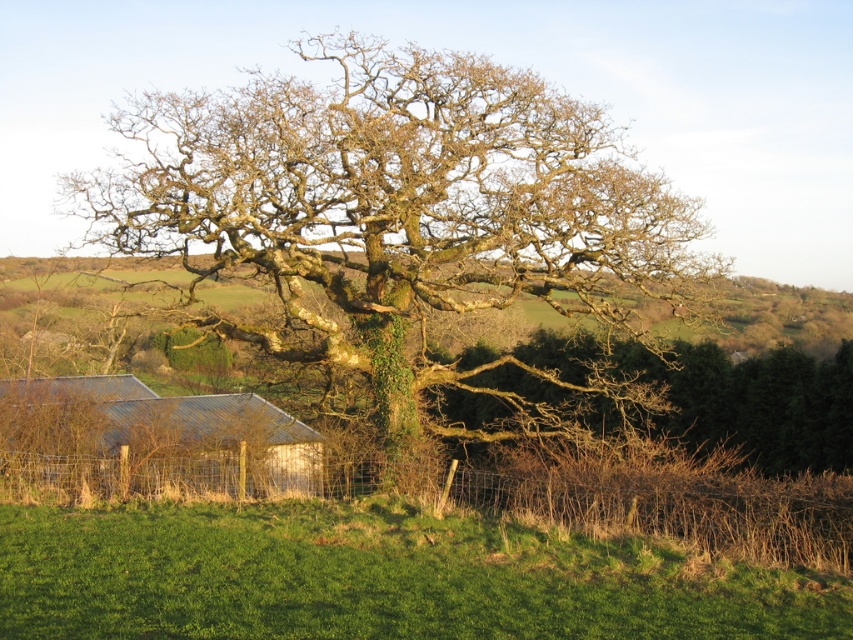
Question: Which object appears farthest from the camera in this image?

Choices:
 (A) green grassy hill at lower center
 (B) white corrugated metal hut at lower left
 (C) green mossy oak at center

Answer: (B)

Question: Can you confirm if green mossy oak at center is thinner than white corrugated metal hut at lower left?

Choices:
 (A) yes
 (B) no

Answer: (B)

Question: Can you confirm if green mossy oak at center is bigger than white corrugated metal hut at lower left?

Choices:
 (A) no
 (B) yes

Answer: (B)

Question: Among these points, which one is nearest to the camera?

Choices:
 (A) tap(387, 180)
 (B) tap(1, 636)
 (C) tap(293, 433)

Answer: (B)

Question: Which of the following is the closest to the observer?

Choices:
 (A) (694, 570)
 (B) (170, 440)

Answer: (A)

Question: Observing the image, what is the correct spatial positioning of green grassy hill at lower center in reference to white corrugated metal hut at lower left?

Choices:
 (A) right
 (B) left

Answer: (A)